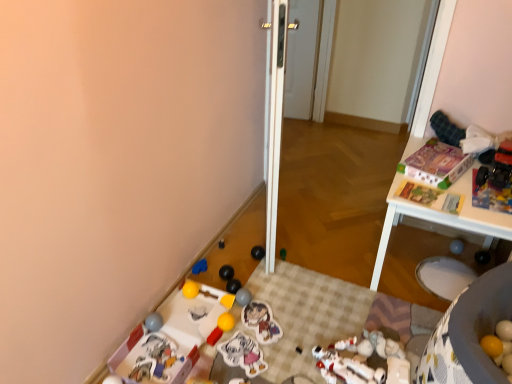
Find the location of a particular element. The image size is (512, 384). vacant area located to the right-hand side of yellow matte toy at lower center, acting as the 12th toy starting from the right is located at coordinates (266, 307).